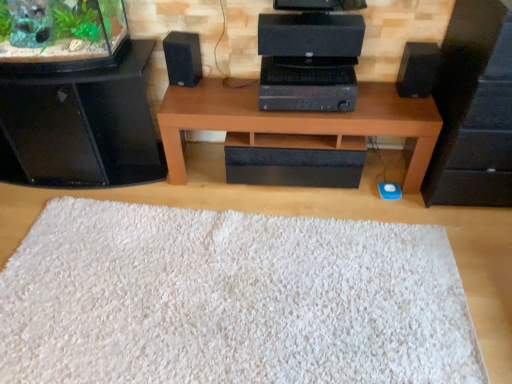
Identify the location of vacant area situated below white shaggy rug at center (from a real-world perspective). (231, 291).